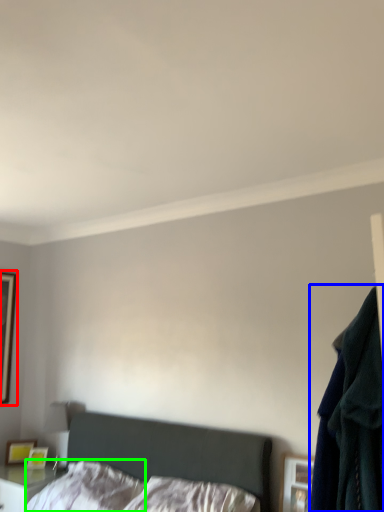
Question: Which object is positioned closest to picture frame (highlighted by a red box)? Select from clothing (highlighted by a blue box) and pillow (highlighted by a green box).

Choices:
 (A) clothing
 (B) pillow

Answer: (B)